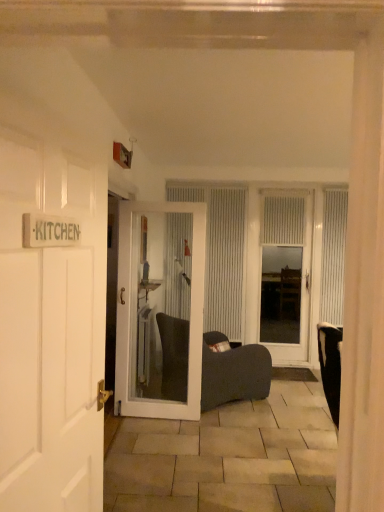
Question: Is white textured curtain at center, placed as the 1th curtain when sorted from left to right, to the left of white glossy door at center, arranged as the second door when viewed from the front, from the viewer's perspective?

Choices:
 (A) yes
 (B) no

Answer: (B)

Question: Can you confirm if white textured curtain at center, placed as the third curtain when sorted from right to left, is bigger than white glossy door at center, the 2th door in the back-to-front sequence?

Choices:
 (A) no
 (B) yes

Answer: (A)

Question: Is white textured curtain at center, placed as the 1th curtain when sorted from left to right, positioned in front of white glossy door at center, placed as the second door when sorted from right to left?

Choices:
 (A) yes
 (B) no

Answer: (B)

Question: Is white textured curtain at center, placed as the third curtain when sorted from right to left, at the right side of white glossy door at center, arranged as the second door when viewed from the front?

Choices:
 (A) yes
 (B) no

Answer: (A)

Question: From the image's perspective, is white textured curtain at center, placed as the 1th curtain when sorted from left to right, below white glossy door at center, placed as the second door when sorted from left to right?

Choices:
 (A) no
 (B) yes

Answer: (A)

Question: Considering the positions of white wooden door at left, the third door from the back, and white glossy door at center, placed as the second door when sorted from left to right, in the image, is white wooden door at left, the third door from the back, wider or thinner than white glossy door at center, placed as the second door when sorted from left to right,?

Choices:
 (A) thin
 (B) wide

Answer: (A)

Question: Looking at the image, does white wooden door at left, the 3th door when ordered from right to left, seem bigger or smaller compared to white glossy door at center, placed as the second door when sorted from right to left?

Choices:
 (A) small
 (B) big

Answer: (A)

Question: Visually, is white wooden door at left, the third door from the back, positioned to the left or to the right of white glossy door at center, placed as the second door when sorted from right to left?

Choices:
 (A) left
 (B) right

Answer: (A)

Question: From their relative heights in the image, would you say white wooden door at left, acting as the first door starting from the left, is taller or shorter than white glossy door at center, placed as the second door when sorted from right to left?

Choices:
 (A) tall
 (B) short

Answer: (B)

Question: Looking at the image, does white glossy door at center, placed as the second door when sorted from left to right, seem bigger or smaller compared to white textured curtain at right, placed as the first curtain when sorted from right to left?

Choices:
 (A) small
 (B) big

Answer: (B)

Question: Considering the relative positions of white glossy door at center, the 2th door in the back-to-front sequence, and white textured curtain at right, the third curtain viewed from the left, in the image provided, is white glossy door at center, the 2th door in the back-to-front sequence, to the left or to the right of white textured curtain at right, the third curtain viewed from the left,?

Choices:
 (A) left
 (B) right

Answer: (A)

Question: From the image's perspective, is white glossy door at center, the 2th door in the back-to-front sequence, positioned above or below white textured curtain at right, the third curtain viewed from the left?

Choices:
 (A) below
 (B) above

Answer: (A)

Question: Is point (203, 229) positioned closer to the camera than point (327, 212)?

Choices:
 (A) farther
 (B) closer

Answer: (B)

Question: Is white glossy door at center, placed as the second door when sorted from left to right, to the left or to the right of white textured curtain at center, placed as the third curtain when sorted from right to left, in the image?

Choices:
 (A) right
 (B) left

Answer: (B)

Question: Is white glossy door at center, the 2th door in the back-to-front sequence, wider or thinner than white textured curtain at center, placed as the 1th curtain when sorted from left to right?

Choices:
 (A) wide
 (B) thin

Answer: (A)